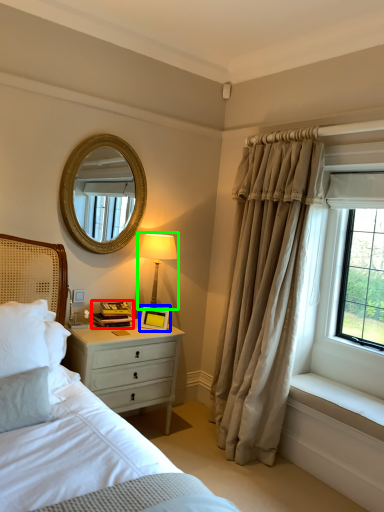
Question: Estimate the real-world distances between objects in this image. Which object is closer to book (highlighted by a red box), picture frame (highlighted by a blue box) or bedside lamp (highlighted by a green box)?

Choices:
 (A) picture frame
 (B) bedside lamp

Answer: (A)